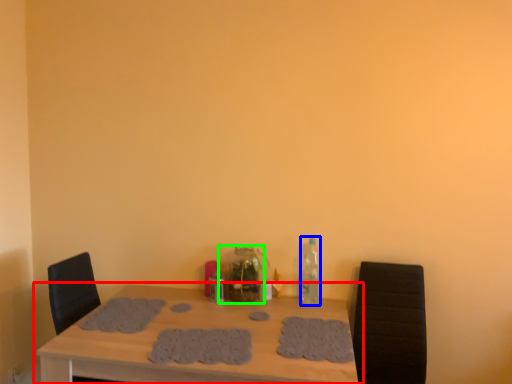
Question: Based on their relative distances, which object is nearer to table (highlighted by a red box)? Choose from bottle (highlighted by a blue box) and bottle (highlighted by a green box).

Choices:
 (A) bottle
 (B) bottle

Answer: (B)